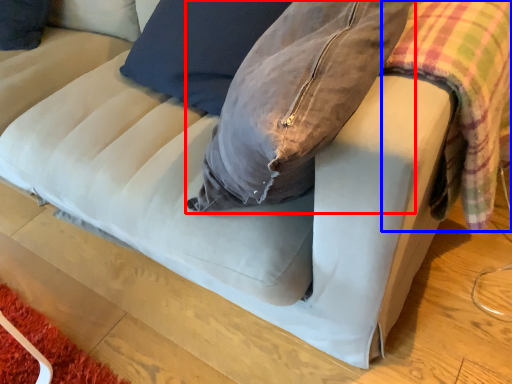
Question: Which point is further to the camera, bean bag chair (highlighted by a red box) or plaid (highlighted by a blue box)?

Choices:
 (A) bean bag chair
 (B) plaid

Answer: (A)